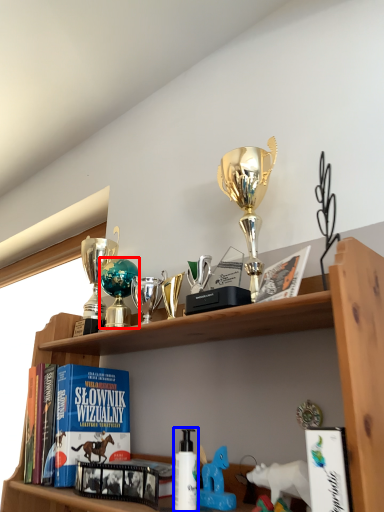
Question: Which of the following is the farthest to the observer, toy (highlighted by a red box) or bottle (highlighted by a blue box)?

Choices:
 (A) toy
 (B) bottle

Answer: (A)